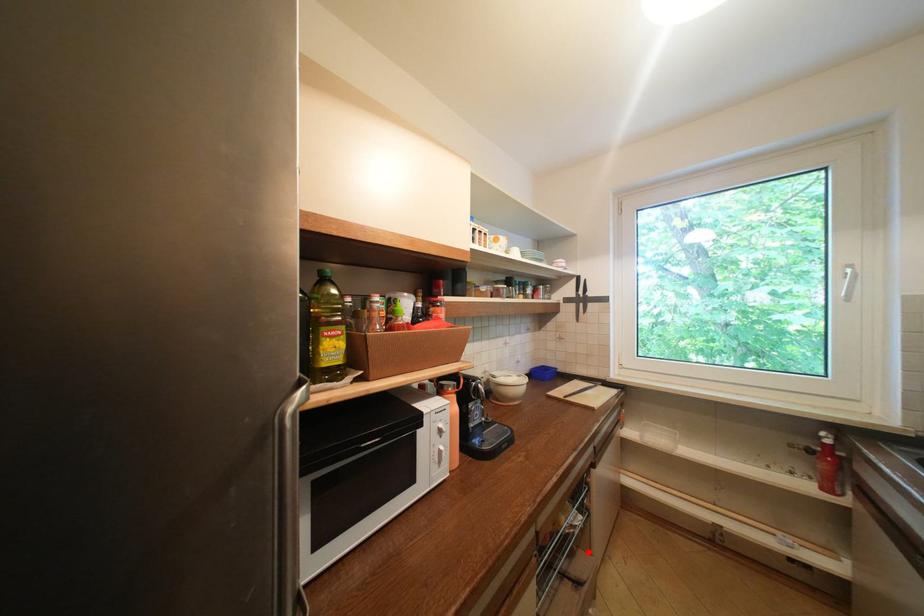
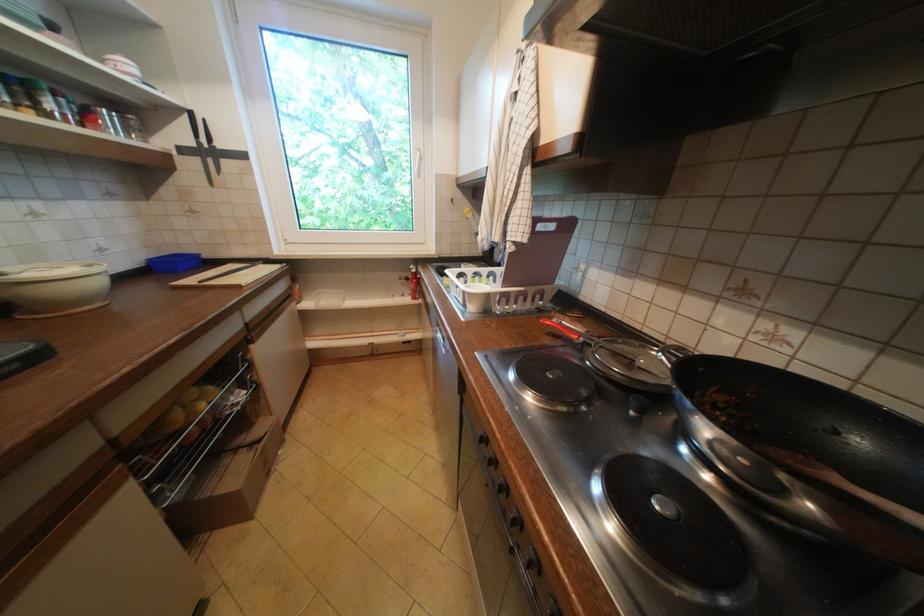
Find the pixel in the second image that matches the highlighted location in the first image.

(270, 419)